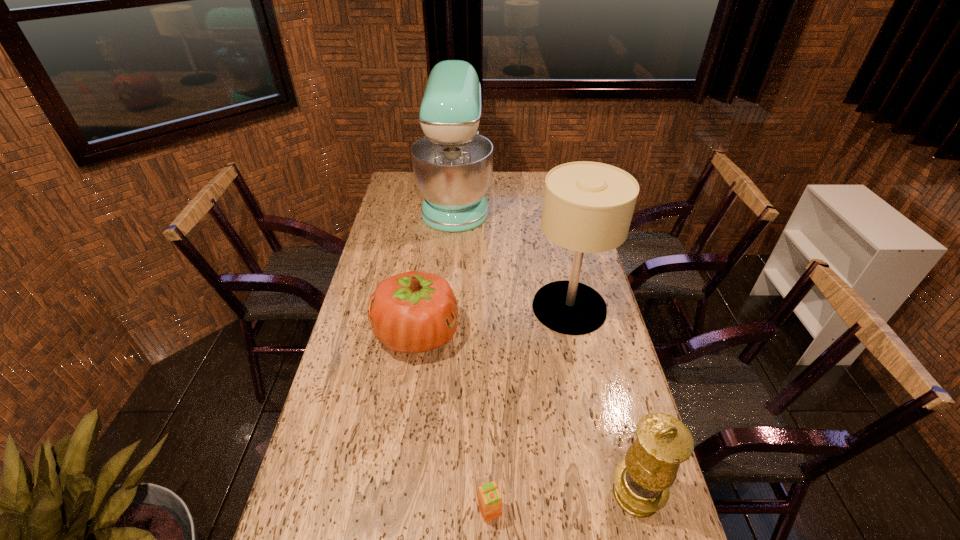
Select which object is the third closest to the shortest object. Please provide its 2D coordinates. Your answer should be formatted as a tuple, i.e. [(x, y)], where the tuple contains the x and y coordinates of a point satisfying the conditions above.

[(588, 206)]

I want to click on vacant space that satisfies the following two spatial constraints: 1. on the side of the pumpkin with the cute face; 2. on the left side of the third tallest object, so click(394, 494).

Find the location of `vacant region that satisfies the following two spatial constraints: 1. at the base of the farthest object; 2. on the right side of the table lamp`. vacant region that satisfies the following two spatial constraints: 1. at the base of the farthest object; 2. on the right side of the table lamp is located at coordinates (447, 308).

Locate an element on the screen. The image size is (960, 540). blank area in the image that satisfies the following two spatial constraints: 1. at the base of the mixer; 2. on the left side of the third shortest object is located at coordinates (433, 494).

I want to click on free space that satisfies the following two spatial constraints: 1. on the back side of the oil lamp; 2. at the base of the mixer, so click(x=560, y=200).

Find the location of a particular element. The width and height of the screenshot is (960, 540). vacant position in the image that satisfies the following two spatial constraints: 1. at the base of the farthest object; 2. on the left side of the oil lamp is located at coordinates (433, 494).

You are a GUI agent. You are given a task and a screenshot of the screen. Output one action in this format:
    pyautogui.click(x=<x>, y=<y>)
    Task: Click on the free point that satisfies the following two spatial constraints: 1. on the back side of the third shortest object; 2. on the side of the pumpkin with the cute face
    The width and height of the screenshot is (960, 540).
    Given the screenshot: What is the action you would take?
    pyautogui.click(x=594, y=334)

Locate an element on the screen. The height and width of the screenshot is (540, 960). free space that satisfies the following two spatial constraints: 1. at the base of the farthest object; 2. on the left side of the shortest object is located at coordinates (432, 511).

The width and height of the screenshot is (960, 540). Identify the location of blank space that satisfies the following two spatial constraints: 1. at the base of the farthest object; 2. on the left side of the third tallest object. (433, 494).

At what (x,y) coordinates should I click in order to perform the action: click on vacant space that satisfies the following two spatial constraints: 1. at the base of the table lamp; 2. on the right side of the mixer. Please return your answer as a coordinate pair (x, y). Looking at the image, I should click on (447, 308).